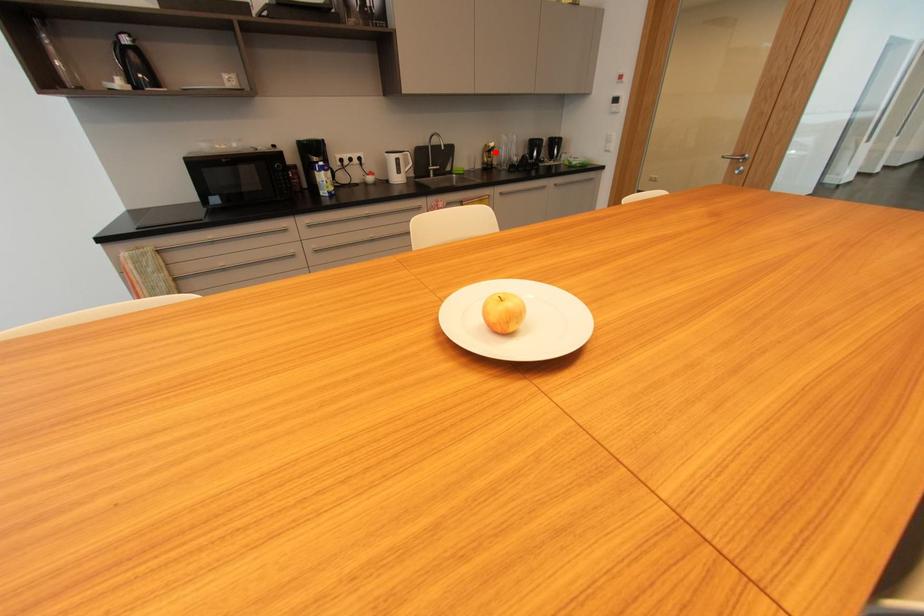
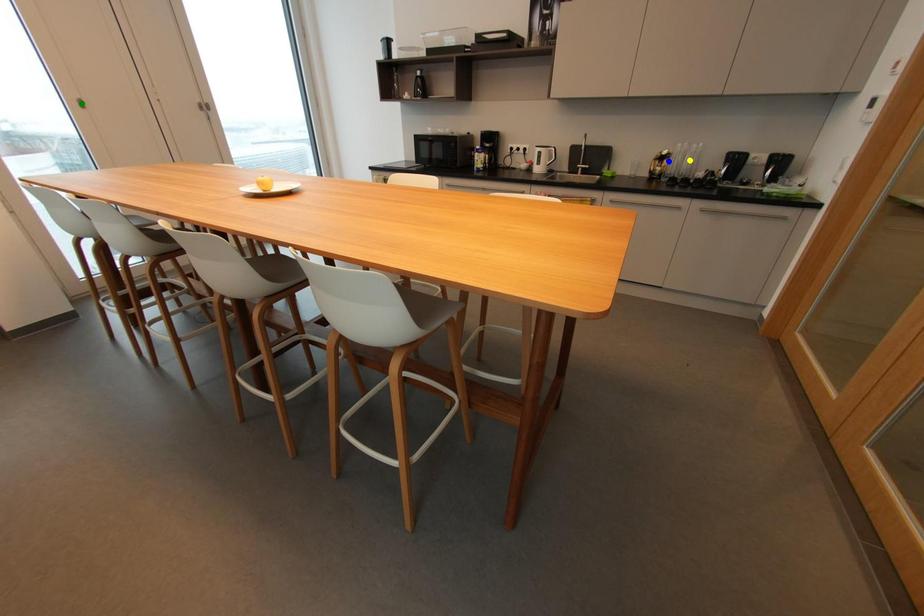
Question: I am providing you with two images of the same scene from different viewpoints. A red point is marked on the first image. You are given multiple points on the second image. Which point in image 2 represents the same 3d spot as the red point in image 1?

Choices:
 (A) green point
 (B) blue point
 (C) yellow point

Answer: (B)